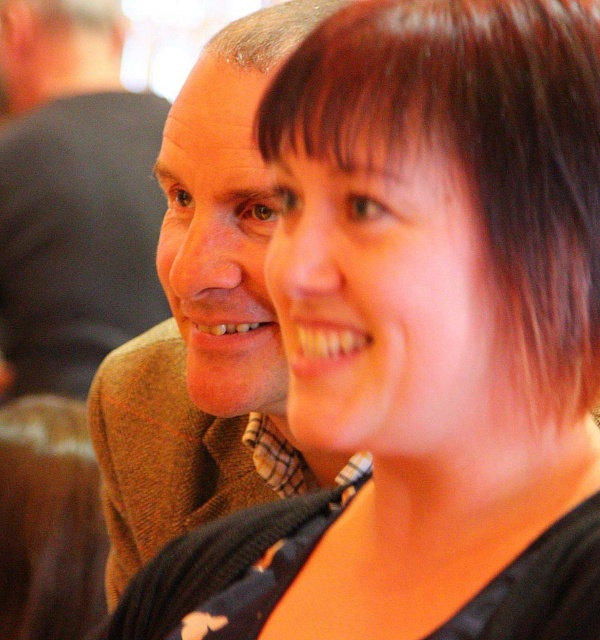
Is brown wool sweater at left thinner than gray matte hair at upper left?

Incorrect, brown wool sweater at left's width is not less than gray matte hair at upper left's.

Who is higher up, brown wool sweater at left or gray matte hair at upper left?

brown wool sweater at left

Which is in front, point (115, 60) or point (247, 36)?

Point (247, 36) is in front.

Find the location of `brown wool sweater at left`. brown wool sweater at left is located at coordinates (73, 195).

Can you confirm if brown wool sweater at center is wider than gray matte hair at upper left?

Indeed, brown wool sweater at center has a greater width compared to gray matte hair at upper left.

Is brown wool sweater at center positioned at the back of gray matte hair at upper left?

No, it is not.

The width and height of the screenshot is (600, 640). What do you see at coordinates (206, 321) in the screenshot?
I see `brown wool sweater at center` at bounding box center [206, 321].

At what (x,y) coordinates should I click in order to perform the action: click on brown wool sweater at center. Please return your answer as a coordinate pair (x, y). The height and width of the screenshot is (640, 600). Looking at the image, I should click on (206, 321).

This screenshot has width=600, height=640. Describe the element at coordinates (477, 141) in the screenshot. I see `brown smooth hair at upper right` at that location.

Who is more distant from viewer, [388,77] or [262,22]?

The point [262,22] is more distant.

What are the coordinates of `brown smooth hair at upper right` in the screenshot? It's located at (477, 141).

Identify the location of brown smooth hair at upper right. This screenshot has width=600, height=640. (477, 141).